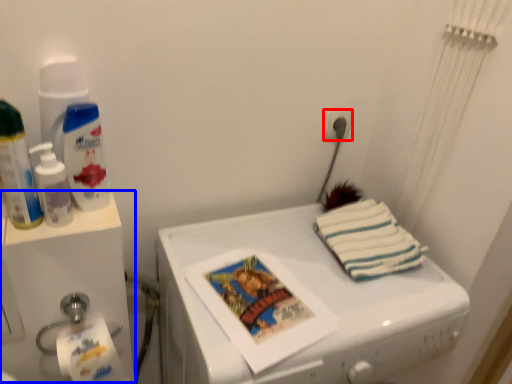
Question: Which object appears closest to the camera in this image, power plugs and sockets (highlighted by a red box) or water cooler (highlighted by a blue box)?

Choices:
 (A) power plugs and sockets
 (B) water cooler

Answer: (B)